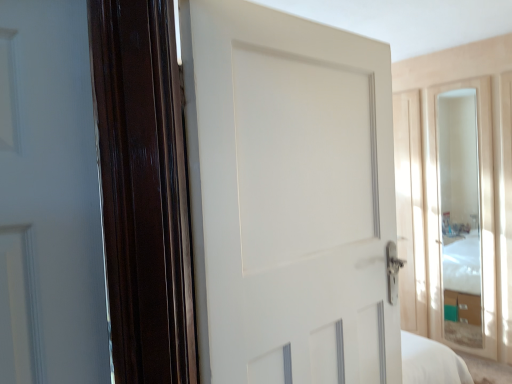
Question: From the image's perspective, is clear glass mirror at right on white matte door at center?

Choices:
 (A) yes
 (B) no

Answer: (B)

Question: From the image's perspective, is clear glass mirror at right below white matte door at center?

Choices:
 (A) no
 (B) yes

Answer: (B)

Question: Considering the relative positions of clear glass mirror at right and white matte door at center in the image provided, is clear glass mirror at right to the left of white matte door at center from the viewer's perspective?

Choices:
 (A) no
 (B) yes

Answer: (A)

Question: Does clear glass mirror at right have a larger size compared to white matte door at center?

Choices:
 (A) yes
 (B) no

Answer: (B)

Question: From a real-world perspective, is clear glass mirror at right located beneath white matte door at center?

Choices:
 (A) no
 (B) yes

Answer: (B)

Question: Does clear glass mirror at right appear on the right side of white matte door at center?

Choices:
 (A) no
 (B) yes

Answer: (B)

Question: Is white matte door at center to the left of clear glass mirror at right from the viewer's perspective?

Choices:
 (A) no
 (B) yes

Answer: (B)

Question: Would you say clear glass mirror at right is part of white matte door at center's contents?

Choices:
 (A) no
 (B) yes

Answer: (A)

Question: Is white matte door at center smaller than clear glass mirror at right?

Choices:
 (A) no
 (B) yes

Answer: (A)

Question: Is white matte door at center shorter than clear glass mirror at right?

Choices:
 (A) yes
 (B) no

Answer: (A)

Question: Is white matte door at center facing towards clear glass mirror at right?

Choices:
 (A) no
 (B) yes

Answer: (A)

Question: Is white matte door at center taller than clear glass mirror at right?

Choices:
 (A) yes
 (B) no

Answer: (B)

Question: Considering the positions of white matte door at center and clear glass mirror at right in the image, is white matte door at center wider or thinner than clear glass mirror at right?

Choices:
 (A) thin
 (B) wide

Answer: (B)